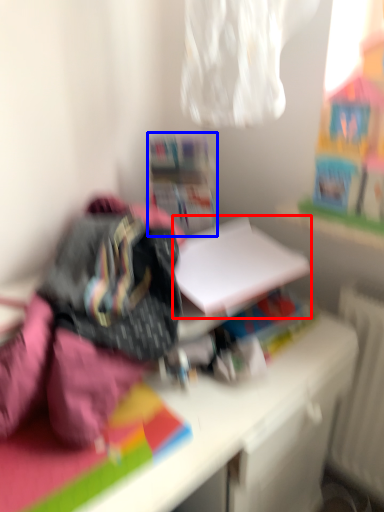
Question: Which of the following is the closest to the observer, paperback book (highlighted by a red box) or shelf (highlighted by a blue box)?

Choices:
 (A) paperback book
 (B) shelf

Answer: (A)